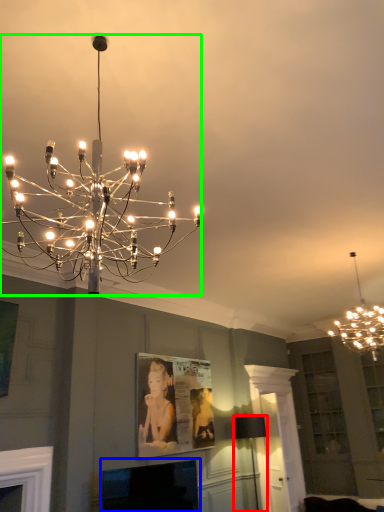
Question: Considering the real-world distances, which object is closest to lamp (highlighted by a red box)? fireplace (highlighted by a blue box) or lamp (highlighted by a green box).

Choices:
 (A) fireplace
 (B) lamp

Answer: (A)